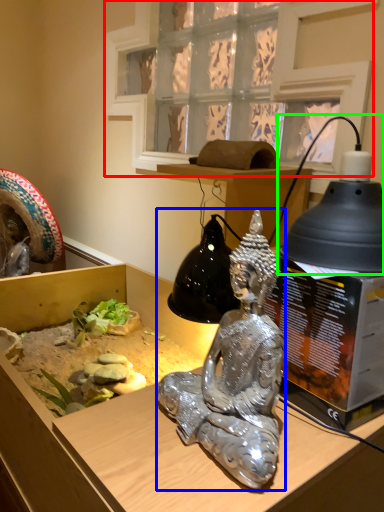
Question: Based on their relative distances, which object is farther from window (highlighted by a red box)? Choose from person (highlighted by a blue box) and lamp (highlighted by a green box).

Choices:
 (A) person
 (B) lamp

Answer: (A)